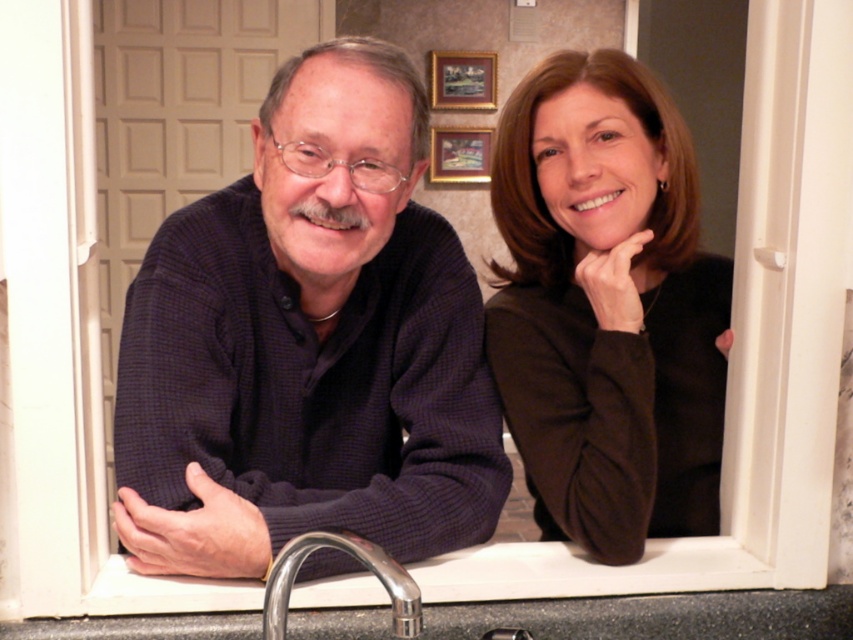
You are a tailor measuring fabrics for alterations. You have a piece of fabric that matches the dark blue sweater at center and need to determine if it can cover the polished chrome faucet at lower center. Can the fabric piece, based on their widths, cover the faucet?

The dark blue sweater at center is wider than the polished chrome faucet at lower center, so the fabric piece can cover the faucet since its width is sufficient.

In the bathroom scene, there is a dark blue sweater at center and a polished chrome faucet at lower center. From the perspective of someone standing in front of the bathroom door, which object is positioned to the right?

The dark blue sweater at center is to the right of the polished chrome faucet at lower center.

You are designing a display stand for a clothing store and need to place both the dark blue sweater at center and the matte brown sweater at right. Since the display has limited space, which sweater should you allocate more space for based on their sizes?

The dark blue sweater at center has a larger width than the matte brown sweater at right, so you should allocate more space for the dark blue sweater at center.